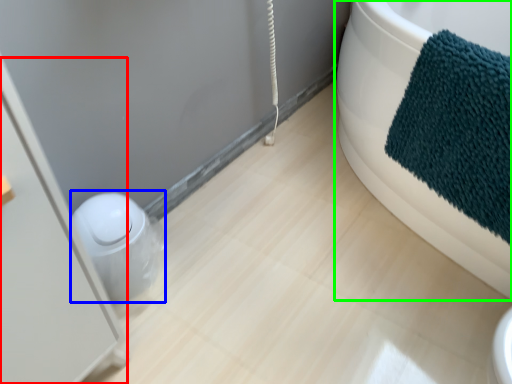
Question: Based on their relative distances, which object is farther from screen door (highlighted by a red box)? Choose from toilet bowl (highlighted by a blue box) and bathtub (highlighted by a green box).

Choices:
 (A) toilet bowl
 (B) bathtub

Answer: (B)